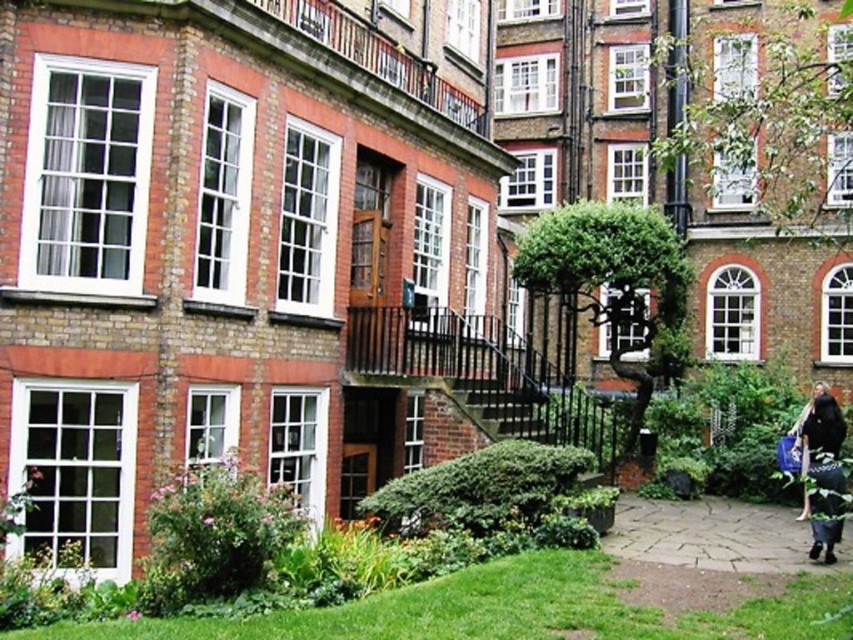
Is smooth stone path at lower right smaller than dark blue fabric bag at lower right?

No.

Does smooth stone path at lower right appear over dark blue fabric bag at lower right?

Actually, smooth stone path at lower right is below dark blue fabric bag at lower right.

Find the location of a particular element. smooth stone path at lower right is located at coordinates (708, 534).